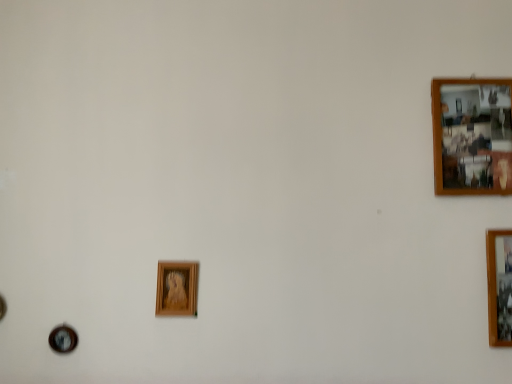
Question: Can you confirm if wooden photo frame at upper right, which appears as the first picture frame when viewed from the top, is positioned to the right of wooden photo frame at right, the 1th picture frame when ordered from right to left?

Choices:
 (A) no
 (B) yes

Answer: (A)

Question: From the image's perspective, is wooden photo frame at upper right, the 2th picture frame from the left, beneath wooden photo frame at right, marked as the 2th picture frame in a bottom-to-top arrangement?

Choices:
 (A) no
 (B) yes

Answer: (A)

Question: Considering the relative sizes of wooden photo frame at upper right, the 2th picture frame from the left, and wooden photo frame at right, the 3th picture frame when ordered from left to right, in the image provided, is wooden photo frame at upper right, the 2th picture frame from the left, thinner than wooden photo frame at right, the 3th picture frame when ordered from left to right,?

Choices:
 (A) yes
 (B) no

Answer: (A)

Question: Is wooden photo frame at upper right, marked as the 3th picture frame in a bottom-to-top arrangement, bigger than wooden photo frame at right, the 3th picture frame when ordered from left to right?

Choices:
 (A) no
 (B) yes

Answer: (A)

Question: Is the depth of wooden photo frame at upper right, which appears as the first picture frame when viewed from the top, greater than that of wooden photo frame at right, the 3th picture frame when ordered from left to right?

Choices:
 (A) yes
 (B) no

Answer: (A)

Question: Does wooden photo frame at upper right, the 2th picture frame from the left, come in front of wooden photo frame at right, the 1th picture frame when ordered from right to left?

Choices:
 (A) no
 (B) yes

Answer: (A)

Question: From a real-world perspective, is wooden photo frame at right, the 2th picture frame from the top, physically below wooden photo frame at upper right, acting as the 2th picture frame starting from the right?

Choices:
 (A) no
 (B) yes

Answer: (B)

Question: From a real-world perspective, does wooden photo frame at right, the 3th picture frame when ordered from left to right, stand above wooden photo frame at upper right, marked as the 3th picture frame in a bottom-to-top arrangement?

Choices:
 (A) no
 (B) yes

Answer: (A)

Question: From the image's perspective, does wooden photo frame at right, the 1th picture frame when ordered from right to left, appear lower than wooden photo frame at upper right, the 2th picture frame from the left?

Choices:
 (A) no
 (B) yes

Answer: (B)

Question: Is wooden photo frame at right, the 1th picture frame when ordered from right to left, shorter than wooden photo frame at upper right, which appears as the first picture frame when viewed from the top?

Choices:
 (A) no
 (B) yes

Answer: (B)

Question: Could you tell me if wooden photo frame at right, the 2th picture frame from the top, is facing wooden photo frame at upper right, the 2th picture frame from the left?

Choices:
 (A) no
 (B) yes

Answer: (A)

Question: From the image's perspective, does wooden photo frame at right, marked as the 2th picture frame in a bottom-to-top arrangement, appear higher than wooden photo frame at upper right, acting as the 2th picture frame starting from the right?

Choices:
 (A) yes
 (B) no

Answer: (B)

Question: Is wooden picture frame at center, the 1th picture frame from the left, completely or partially outside of wooden photo frame at upper right, which appears as the first picture frame when viewed from the top?

Choices:
 (A) no
 (B) yes

Answer: (B)